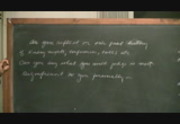
Where is `second line of writing on chalkboard`? The image size is (180, 124). second line of writing on chalkboard is located at coordinates (22, 52), (56, 52), (75, 50), (123, 52), (108, 52).